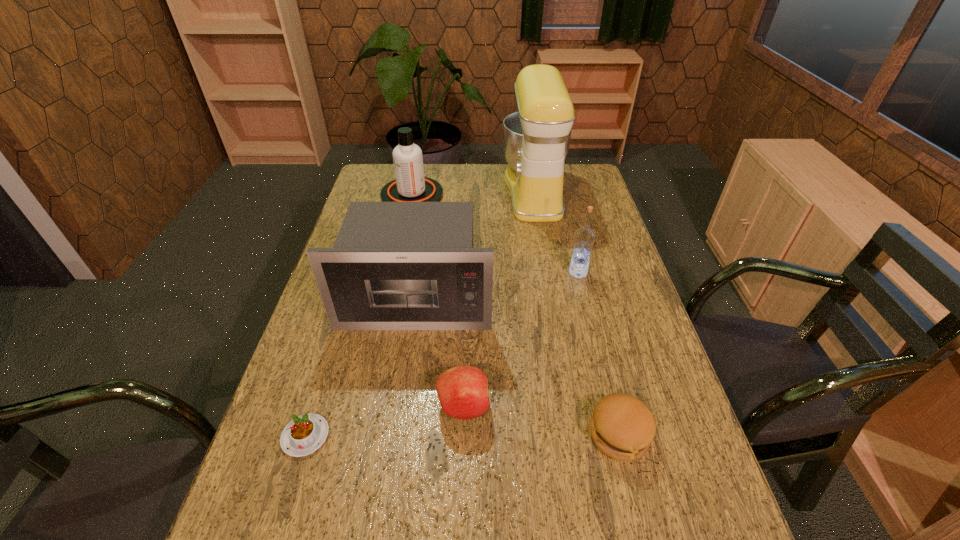
Identify the location of pudding present at the left edge. (302, 436).

I want to click on mixer located in the right edge section of the desktop, so click(x=536, y=138).

The image size is (960, 540). I want to click on vodka that is at the right edge, so click(x=584, y=237).

This screenshot has height=540, width=960. In order to click on hamburger that is at the right edge in this screenshot , I will do `click(622, 426)`.

I want to click on object that is at the far left corner, so pos(410,185).

You are a GUI agent. You are given a task and a screenshot of the screen. Output one action in this format:
    pyautogui.click(x=<x>, y=<y>)
    Task: Click on the object that is at the far right corner
    
    Given the screenshot: What is the action you would take?
    pyautogui.click(x=536, y=138)

Locate an element on the screen. Image resolution: width=960 pixels, height=540 pixels. vacant space at the far edge of the desktop is located at coordinates (463, 168).

Identify the location of vacant point at the left edge. The image size is (960, 540). (362, 198).

Where is `vacant space at the right edge`? vacant space at the right edge is located at coordinates (579, 211).

Where is `vacant area that lies between the vodka and the sixth tallest object`? vacant area that lies between the vodka and the sixth tallest object is located at coordinates (598, 354).